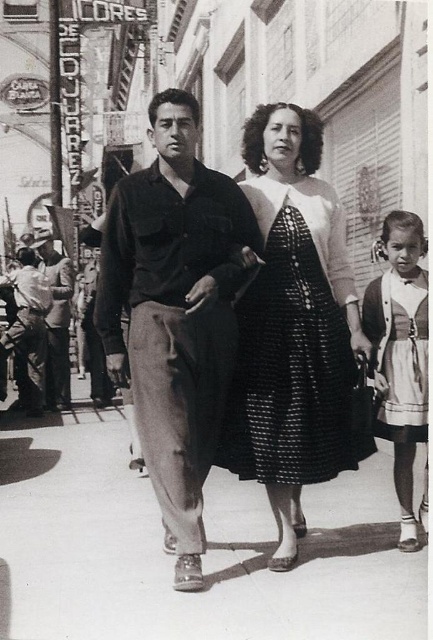
You are a photographer trying to capture the family in the scene. You want to ensure that both the matte black jacket at left and the white cotton dirndl at right are clearly visible in your shot. Based on their positions, which one is closer to the camera?

The matte black jacket at left is closer to the camera because the white cotton dirndl at right is positioned behind it.

You are a photographer standing 5 meters away from the smooth black shirt at center. You want to take a photo of the black sequined dress at center without moving. Can you capture it in the same frame without zooming? Explain your reasoning.

The distance between the smooth black shirt at center and the black sequined dress at center is 3.92 meters. Since you are 5 meters away from the smooth black shirt at center, the black sequined dress at center is within that distance. Therefore, you can capture it in the same frame without zooming as it is closer than your current position.

Consider the image. In the image, there are a man in a dark long sleeve shirt and light trousers, a woman in a dark dress with a patterned skirt and lighter top, and a young girl. You are standing at the point with coordinates point (28,330) which is the location of the matte black jacket at left. You want to walk to the young girl. Which direction should you go?

The point (28,330) indicates the matte black jacket at left. To reach the young girl, you should move towards the right since the young girl is positioned to the right of the man, who is ahead of the two women. Since you are at the left side, moving right would lead you toward the center where the women and girl are located.